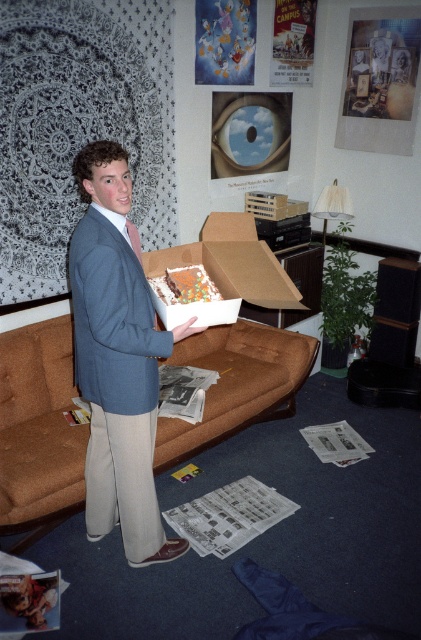
Between white cardboard box at center and pink satin tie at left, which one is positioned higher?

white cardboard box at center is higher up.

You are a GUI agent. You are given a task and a screenshot of the screen. Output one action in this format:
    pyautogui.click(x=<x>, y=<y>)
    Task: Click on the white cardboard box at center
    This screenshot has width=421, height=640.
    Given the screenshot: What is the action you would take?
    pyautogui.click(x=232, y=262)

The height and width of the screenshot is (640, 421). Describe the element at coordinates (232, 262) in the screenshot. I see `white cardboard box at center` at that location.

You are a GUI agent. You are given a task and a screenshot of the screen. Output one action in this format:
    pyautogui.click(x=<x>, y=<y>)
    Task: Click on the white cardboard box at center
    
    Given the screenshot: What is the action you would take?
    pyautogui.click(x=232, y=262)

Who is more distant from viewer, (141,474) or (216,323)?

Positioned behind is point (141,474).

What do you see at coordinates (117, 362) in the screenshot? The width and height of the screenshot is (421, 640). I see `matte blue blazer at center` at bounding box center [117, 362].

Where is `matte blue blazer at center`? The height and width of the screenshot is (640, 421). matte blue blazer at center is located at coordinates (117, 362).

Is matte blue blazer at center positioned before pink satin tie at left?

Yes, it is.

Does matte blue blazer at center appear on the left side of pink satin tie at left?

Correct, you'll find matte blue blazer at center to the left of pink satin tie at left.

Between point (138, 323) and point (140, 259), which one is positioned in front?

Point (138, 323)

Where is `matte blue blazer at center`? The image size is (421, 640). matte blue blazer at center is located at coordinates (117, 362).